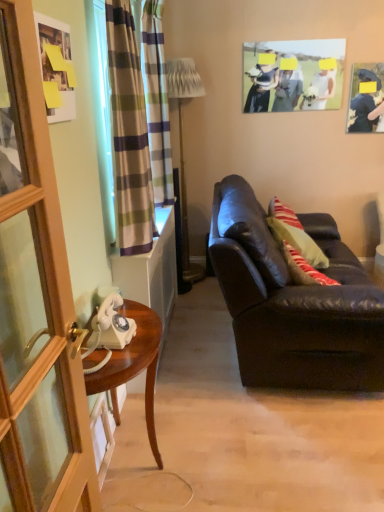
Describe the element at coordinates (294, 302) in the screenshot. The width and height of the screenshot is (384, 512). I see `matte black couch at right` at that location.

Describe the element at coordinates (56, 67) in the screenshot. I see `matte white picture frame at upper left, which is counted as the first picture frame, starting from the front` at that location.

What do you see at coordinates (134, 365) in the screenshot? I see `wooden desk at left` at bounding box center [134, 365].

This screenshot has width=384, height=512. Describe the element at coordinates (156, 102) in the screenshot. I see `plaid fabric curtain at left, which ranks as the first curtain in back-to-front order` at that location.

Measure the distance between matte black picture frame at upper right, the second picture frame ordered from the bottom, and camera.

A distance of 3.28 meters exists between matte black picture frame at upper right, the second picture frame ordered from the bottom, and camera.

The width and height of the screenshot is (384, 512). I want to click on wooden screen door at left, so click(36, 298).

Locate an element on the screen. matte paper photo frame at upper center, the first picture frame from the top is located at coordinates (293, 75).

Identify the location of matte black couch at right. (294, 302).

Where is `cabinetry below the metallic gold floor lamp at center (from the image's perspective)`? This screenshot has height=512, width=384. cabinetry below the metallic gold floor lamp at center (from the image's perspective) is located at coordinates (151, 271).

Can you tell me how much metallic gold floor lamp at center and white glossy telephone at left differ in facing direction?

0.242 degrees.

Does point (195, 76) come closer to viewer compared to point (147, 277)?

No, (195, 76) is further to viewer.

Does metallic gold floor lamp at center appear on the right side of white glossy telephone at left?

Correct, you'll find metallic gold floor lamp at center to the right of white glossy telephone at left.

From a real-world perspective, is matte black picture frame at upper right, which is counted as the first picture frame, starting from the right, beneath plaid fabric curtain at left, which appears as the second curtain when viewed from the front?

Yes.

From the image's perspective, between matte black picture frame at upper right, which is counted as the first picture frame, starting from the right, and plaid fabric curtain at left, which ranks as the first curtain in back-to-front order, which one is located above?

From the image's view, matte black picture frame at upper right, which is counted as the first picture frame, starting from the right, is above.

Looking at the image, does matte black picture frame at upper right, which is counted as the first picture frame, starting from the right, seem bigger or smaller compared to plaid fabric curtain at left, which ranks as the first curtain in back-to-front order?

matte black picture frame at upper right, which is counted as the first picture frame, starting from the right, is smaller than plaid fabric curtain at left, which ranks as the first curtain in back-to-front order.

Who is bigger, plaid fabric curtain at left, which appears as the second curtain when viewed from the front, or plaid fabric curtain at left, acting as the 2th curtain starting from the back?

plaid fabric curtain at left, which appears as the second curtain when viewed from the front, is bigger.

Is plaid fabric curtain at left, which appears as the second curtain when viewed from the front, taller than plaid fabric curtain at left, placed as the first curtain when sorted from front to back?

Correct, plaid fabric curtain at left, which appears as the second curtain when viewed from the front, is much taller as plaid fabric curtain at left, placed as the first curtain when sorted from front to back.

Is plaid fabric curtain at left, which ranks as the first curtain in back-to-front order, located outside plaid fabric curtain at left, acting as the 2th curtain starting from the back?

Yes.

Which is correct: wooden desk at left is inside matte paper photo frame at upper center, positioned as the third picture frame in bottom-to-top order, or outside of it?

wooden desk at left is spatially situated outside matte paper photo frame at upper center, positioned as the third picture frame in bottom-to-top order.

Which of these two, wooden desk at left or matte paper photo frame at upper center, which is the second picture frame from front to back, is wider?

With larger width is wooden desk at left.

Can you see wooden desk at left touching matte paper photo frame at upper center, positioned as the third picture frame in bottom-to-top order?

There is a gap between wooden desk at left and matte paper photo frame at upper center, positioned as the third picture frame in bottom-to-top order.

Is there a large distance between white glossy telephone at left and plaid fabric curtain at left, acting as the 2th curtain starting from the back?

Actually, white glossy telephone at left and plaid fabric curtain at left, acting as the 2th curtain starting from the back, are a little close together.

From the picture: From a real-world perspective, relative to plaid fabric curtain at left, acting as the 2th curtain starting from the back, is white glossy telephone at left vertically above or below?

Clearly, from a real-world perspective, white glossy telephone at left is below plaid fabric curtain at left, acting as the 2th curtain starting from the back.

Is white glossy telephone at left completely or partially outside of plaid fabric curtain at left, placed as the first curtain when sorted from front to back?

Absolutely, white glossy telephone at left is external to plaid fabric curtain at left, placed as the first curtain when sorted from front to back.

From the image's perspective, which object appears higher, white glossy telephone at left or plaid fabric curtain at left, placed as the first curtain when sorted from front to back?

plaid fabric curtain at left, placed as the first curtain when sorted from front to back, appears higher in the image.

Locate an element on the screen. the 2nd curtain to the left when counting from the matte black picture frame at upper right, the second picture frame ordered from the bottom is located at coordinates (129, 134).

Which is behind, point (127, 90) or point (375, 126)?

The point (375, 126) is behind.

From the picture: Which of these two, plaid fabric curtain at left, acting as the 2th curtain starting from the back, or matte black picture frame at upper right, the second picture frame ordered from the bottom, is wider?

With larger width is plaid fabric curtain at left, acting as the 2th curtain starting from the back.

Is matte black picture frame at upper right, which is counted as the first picture frame, starting from the right, located within plaid fabric curtain at left, acting as the 2th curtain starting from the back?

Actually, matte black picture frame at upper right, which is counted as the first picture frame, starting from the right, is outside plaid fabric curtain at left, acting as the 2th curtain starting from the back.

Can we say matte paper photo frame at upper center, the first picture frame from the top, lies outside matte white picture frame at upper left, positioned as the third picture frame in back-to-front order?

Yes, matte paper photo frame at upper center, the first picture frame from the top, is located beyond the bounds of matte white picture frame at upper left, positioned as the third picture frame in back-to-front order.

Is matte paper photo frame at upper center, which is the second picture frame from front to back, aimed at matte white picture frame at upper left, positioned as the third picture frame in right-to-left order?

Yes.

I want to click on the 2nd picture frame above the matte white picture frame at upper left, which is counted as the first picture frame, starting from the front (from the image's perspective), so click(293, 75).

What's the angular difference between matte paper photo frame at upper center, positioned as the third picture frame in bottom-to-top order, and matte white picture frame at upper left, positioned as the third picture frame in back-to-front order,'s facing directions?

The angular difference between matte paper photo frame at upper center, positioned as the third picture frame in bottom-to-top order, and matte white picture frame at upper left, positioned as the third picture frame in back-to-front order, is 88.6 degrees.

Identify the location of cabinetry below the metallic gold floor lamp at center (from the image's perspective). (151, 271).

Identify the location of the 1st curtain counting from the left side of the matte black picture frame at upper right, the second picture frame when ordered from top to bottom. (156, 102).

Considering their positions, is metallic gold floor lamp at center positioned further to white glossy telephone at left than wooden screen door at left?

Among the two, wooden screen door at left is located further to white glossy telephone at left.

Which object lies nearer to the anchor point white glossy telephone at left, matte black picture frame at upper right, the second picture frame ordered from the bottom, or matte paper photo frame at upper center, which is the second picture frame from front to back?

matte paper photo frame at upper center, which is the second picture frame from front to back, is closer to white glossy telephone at left.

Which object lies nearer to the anchor point metallic gold floor lamp at center, matte black couch at right or plaid fabric curtain at left, which ranks as the first curtain in back-to-front order?

plaid fabric curtain at left, which ranks as the first curtain in back-to-front order, is closer to metallic gold floor lamp at center.

Looking at the image, which one is located further to matte black couch at right, wooden screen door at left or metallic gold floor lamp at center?

wooden screen door at left is further to matte black couch at right.

Considering their positions, is matte black picture frame at upper right, the second picture frame when ordered from top to bottom, positioned further to wooden screen door at left than white glossy telephone at left?

Among the two, matte black picture frame at upper right, the second picture frame when ordered from top to bottom, is located further to wooden screen door at left.

Looking at the image, which one is located closer to metallic gold floor lamp at center, matte black picture frame at upper right, which ranks as the first picture frame in back-to-front order, or plaid fabric curtain at left, which ranks as the first curtain in back-to-front order?

The object closer to metallic gold floor lamp at center is plaid fabric curtain at left, which ranks as the first curtain in back-to-front order.

Estimate the real-world distances between objects in this image. Which object is further from metallic gold floor lamp at center, wooden screen door at left or matte white picture frame at upper left, positioned as the third picture frame in back-to-front order?

Based on the image, wooden screen door at left appears to be further to metallic gold floor lamp at center.

When comparing their distances from wooden desk at left, does wooden screen door at left or matte white picture frame at upper left, the first picture frame when ordered from bottom to top, seem closer?

wooden screen door at left is closer to wooden desk at left.

Locate an element on the screen. The height and width of the screenshot is (512, 384). lamp positioned between wooden screen door at left and matte paper photo frame at upper center, which is the second picture frame from front to back, from near to far is located at coordinates (182, 147).

In order to click on cabinetry between matte white picture frame at upper left, the first picture frame when ordered from bottom to top, and matte black couch at right in this screenshot , I will do `click(151, 271)`.

You are a GUI agent. You are given a task and a screenshot of the screen. Output one action in this format:
    pyautogui.click(x=<x>, y=<y>)
    Task: Click on the curtain between white glossy telephone at left and matte black picture frame at upper right, placed as the third picture frame when sorted from left to right, from left to right
    This screenshot has height=512, width=384.
    Given the screenshot: What is the action you would take?
    pyautogui.click(x=156, y=102)

Locate an element on the screen. The image size is (384, 512). curtain positioned between matte black couch at right and metallic gold floor lamp at center from near to far is located at coordinates (156, 102).